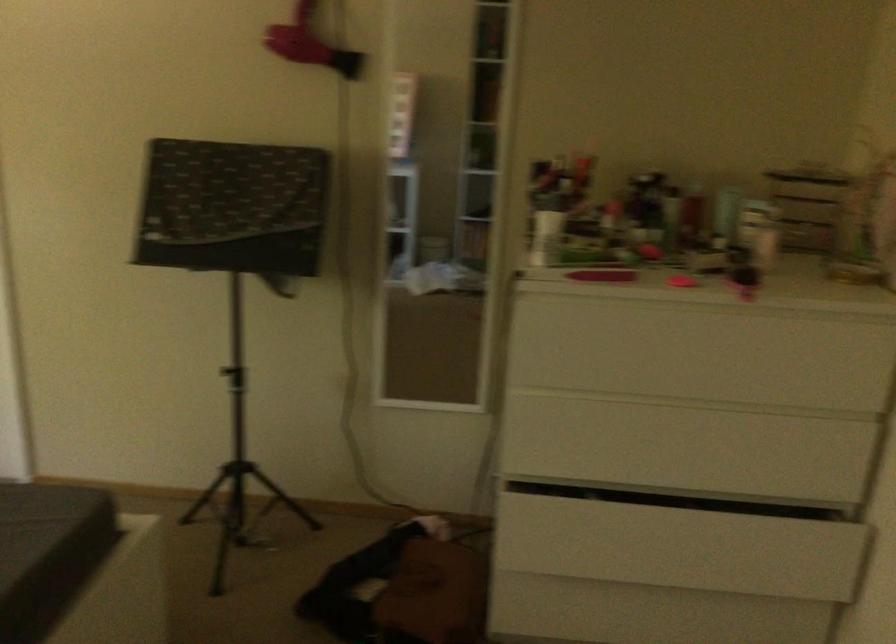
Find where to lift the pink hairdryer. Please return your answer as a coordinate pair (x, y).

(309, 44)